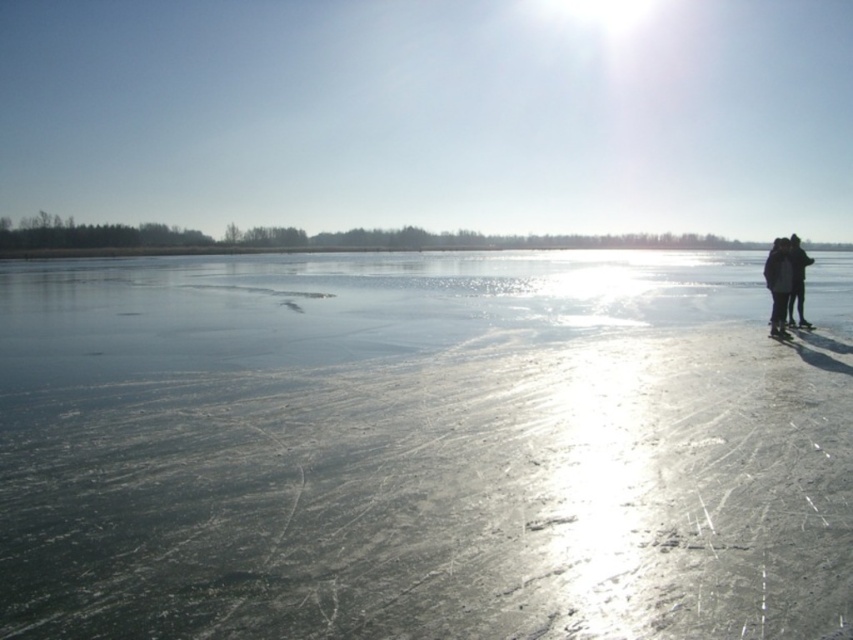
Question: Which object is closer to the camera taking this photo?

Choices:
 (A) black matte jacket at right
 (B) dark gray woolen jackets at right

Answer: (B)

Question: Does dark gray woolen jackets at right have a lesser width compared to black matte jacket at right?

Choices:
 (A) yes
 (B) no

Answer: (B)

Question: In this image, where is dark gray woolen jackets at right located relative to black matte jacket at right?

Choices:
 (A) above
 (B) below

Answer: (B)

Question: Is dark gray woolen jackets at right smaller than black matte jacket at right?

Choices:
 (A) no
 (B) yes

Answer: (A)

Question: Which point appears farthest from the camera in this image?

Choices:
 (A) (799, 305)
 (B) (788, 241)

Answer: (A)